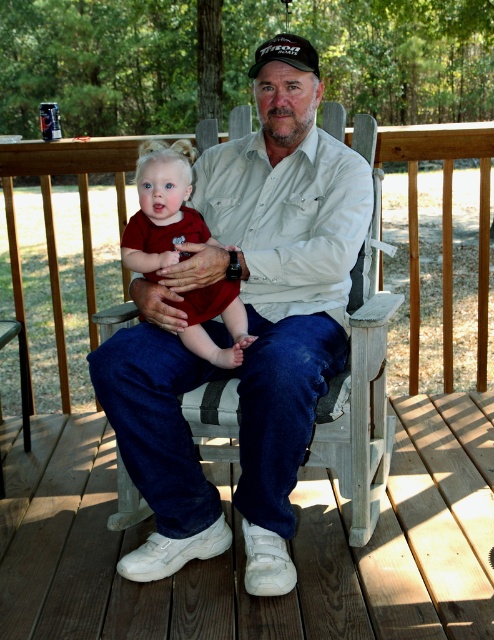
Based on the photo, is white wood deck at lower center bigger than matte red dress at center?

Yes.

Between point (119, 545) and point (205, 352), which one is positioned in front?

Point (205, 352)

Is point (474, 554) behind point (197, 337)?

No, it is not.

Where is `white wood deck at lower center`? white wood deck at lower center is located at coordinates (243, 545).

Does point (207, 260) come closer to viewer compared to point (241, 572)?

That is False.

The image size is (494, 640). Identify the location of matte khaki shirt at center. click(248, 332).

Can you confirm if white wood deck at lower center is taller than black fabric baseball cap at center?

Indeed, white wood deck at lower center has a greater height compared to black fabric baseball cap at center.

How much distance is there between white wood deck at lower center and black fabric baseball cap at center?

A distance of 2.02 meters exists between white wood deck at lower center and black fabric baseball cap at center.

Which is behind, point (453, 538) or point (266, 54)?

The point (453, 538) is behind.

Locate an element on the screen. The width and height of the screenshot is (494, 640). white wood deck at lower center is located at coordinates (243, 545).